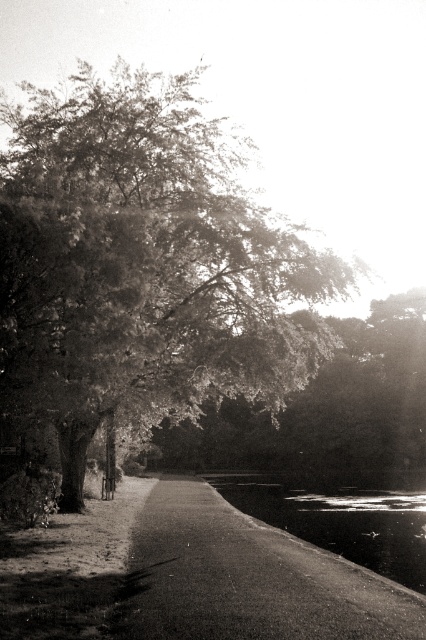
Question: Does grainy black tree at upper left appear on the left side of smooth asphalt path at center?

Choices:
 (A) yes
 (B) no

Answer: (A)

Question: Is grainy black tree at upper left further to the viewer compared to smooth asphalt path at center?

Choices:
 (A) no
 (B) yes

Answer: (B)

Question: Which point is closer to the camera?

Choices:
 (A) (158, 397)
 (B) (155, 586)

Answer: (B)

Question: Which point appears farthest from the camera in this image?

Choices:
 (A) (420, 628)
 (B) (8, 228)

Answer: (B)

Question: Among these points, which one is farthest from the camera?

Choices:
 (A) (138, 614)
 (B) (118, 344)

Answer: (B)

Question: Is grainy black tree at upper left positioned behind smooth asphalt path at center?

Choices:
 (A) yes
 (B) no

Answer: (A)